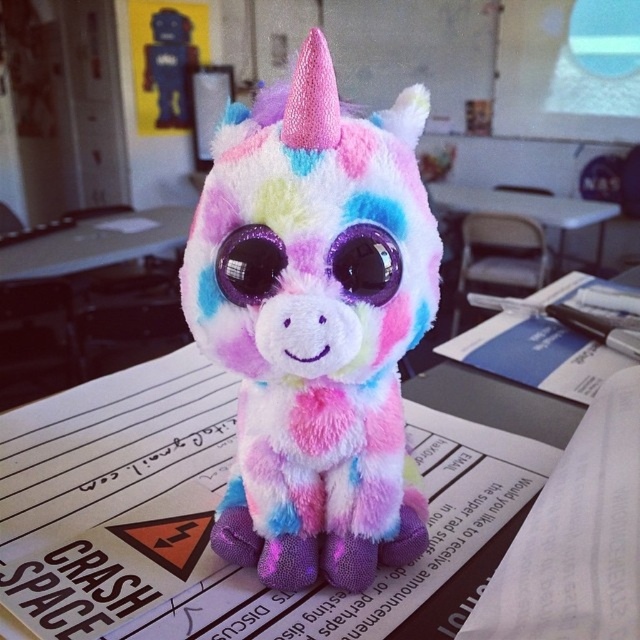
Is plush unicorn at center taller than shiny purple eyes at center?

Correct, plush unicorn at center is much taller as shiny purple eyes at center.

Is plush unicorn at center behind shiny purple eyes at center?

That is False.

Identify the location of plush unicorn at center. The height and width of the screenshot is (640, 640). (211, 513).

Is fluffy rainbow unicorn at center positioned at the back of plush unicorn at center?

That is False.

Identify the location of fluffy rainbow unicorn at center. (314, 323).

What do you see at coordinates (314, 323) in the screenshot? I see `fluffy rainbow unicorn at center` at bounding box center [314, 323].

Locate an element on the screen. fluffy rainbow unicorn at center is located at coordinates (314, 323).

Does shiny purple eyes at center have a lesser width compared to white plastic table at center?

Correct, shiny purple eyes at center's width is less than white plastic table at center's.

Where is `shiny purple eyes at center`? shiny purple eyes at center is located at coordinates (365, 262).